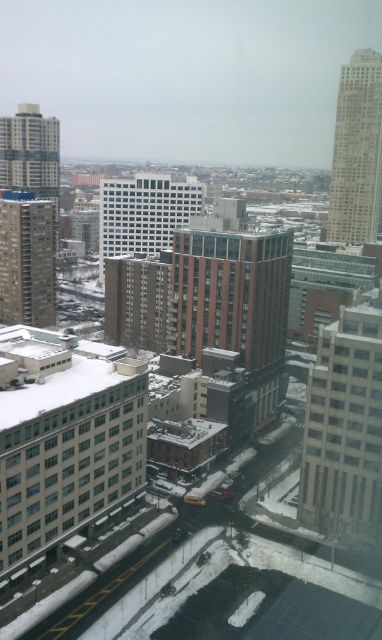
Based on the photo, you are standing on a balcony overlooking the winter street scene. You notice two white glass structures in the view. Which one is closer to you, the white glass windows at lower left or the white glass building at center?

The white glass windows at lower left are closer to you than the white glass building at center.

Consider the image. You are standing on a balcony overlooking the winter street scene. You notice a point marked at coordinates (66, 452). Which object in the scene corresponds to this coordinate?

The point at (66, 452) corresponds to the white glass windows at lower left.